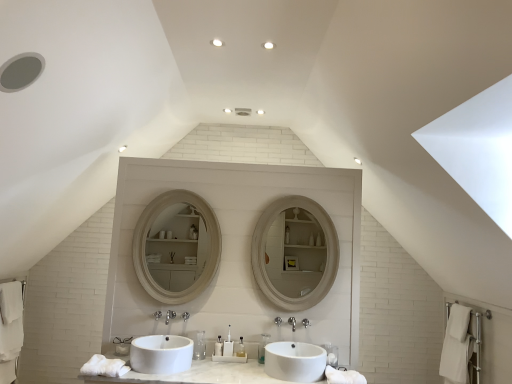
Question: Considering the positions of translucent plastic toothbrush at center, arranged as the 4th toiletry when viewed from the right, and translucent plastic toothbrush at center, the second toiletry from the left, in the image, is translucent plastic toothbrush at center, arranged as the 4th toiletry when viewed from the right, bigger or smaller than translucent plastic toothbrush at center, the second toiletry from the left,?

Choices:
 (A) big
 (B) small

Answer: (A)

Question: From the image's perspective, relative to translucent plastic toothbrush at center, acting as the fifth toiletry starting from the right, is translucent plastic toothbrush at center, arranged as the 4th toiletry when viewed from the right, above or below?

Choices:
 (A) below
 (B) above

Answer: (A)

Question: Based on their relative distances, which object is nearer to the translucent plastic toothbrush at center, the second toiletry from the left?

Choices:
 (A) white glossy sink at center, positioned as the first sink in left-to-right order
 (B) matte white mirror at center
 (C) clear plastic toothbrush at center, acting as the 2th toiletry starting from the right
 (D) white glossy sink at center, the first sink viewed from the right
 (E) translucent plastic toiletries at center, the third toiletry positioned from the right

Answer: (E)

Question: Considering the real-world distances, which object is closest to the clear plastic toothbrush at center, acting as the 2th toiletry starting from the right?

Choices:
 (A) brushed metal faucet at center, the first plumbing fixture from the left
 (B) white glossy sink at center, positioned as the first sink in left-to-right order
 (C) polished chrome faucet at center, acting as the 1th plumbing fixture starting from the right
 (D) white soft towel at lower left, which is the 2th bath towel in right-to-left order
 (E) white cotton bath towel at lower left, the first bath towel in the left-to-right sequence

Answer: (C)